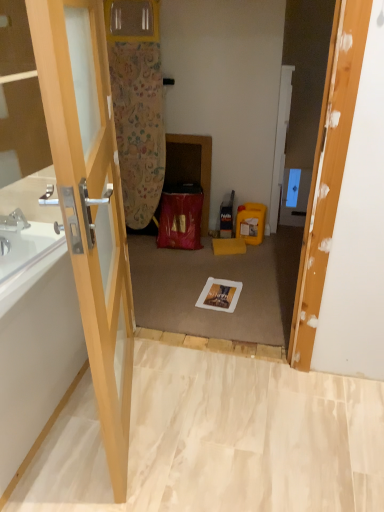
Locate an element on the screen. This screenshot has height=512, width=384. space that is in front of transparent glass door at left is located at coordinates (102, 471).